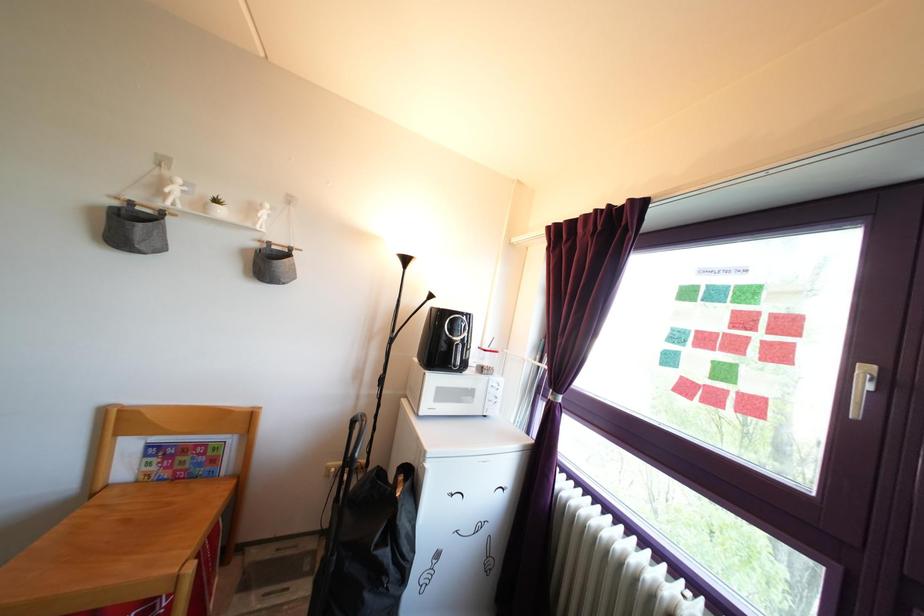
Where would you pull the air fryer handle? Please return your answer as a coordinate pair (x, y).

(861, 387)